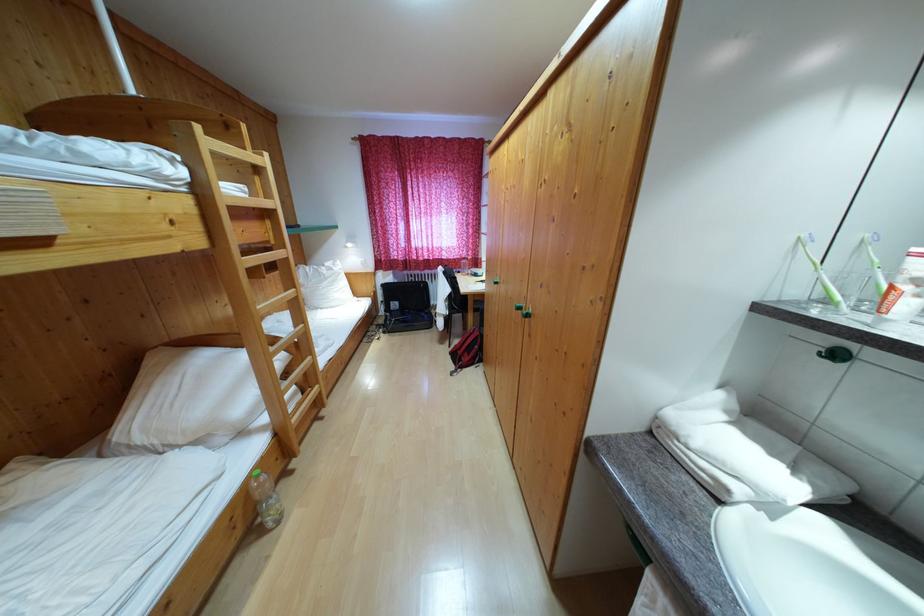
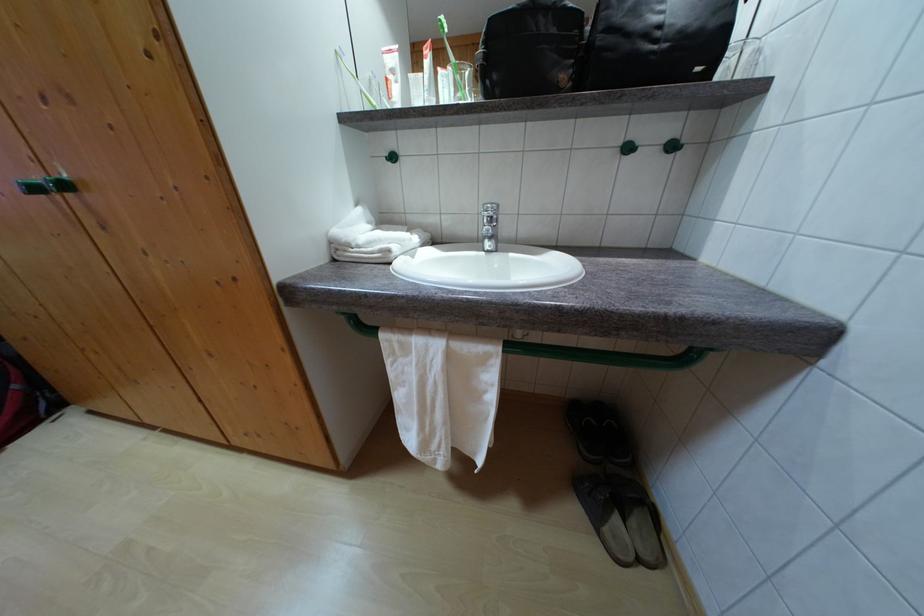
The images are taken continuously from a first-person perspective. In which direction is your viewpoint rotating?

The camera rotated toward right-down.